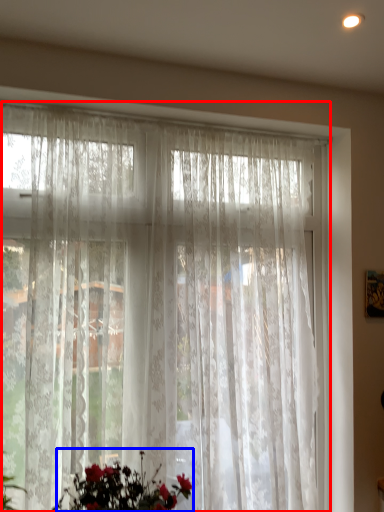
Question: Which object appears farthest to the camera in this image, curtain (highlighted by a red box) or floral arrangement (highlighted by a blue box)?

Choices:
 (A) curtain
 (B) floral arrangement

Answer: (A)